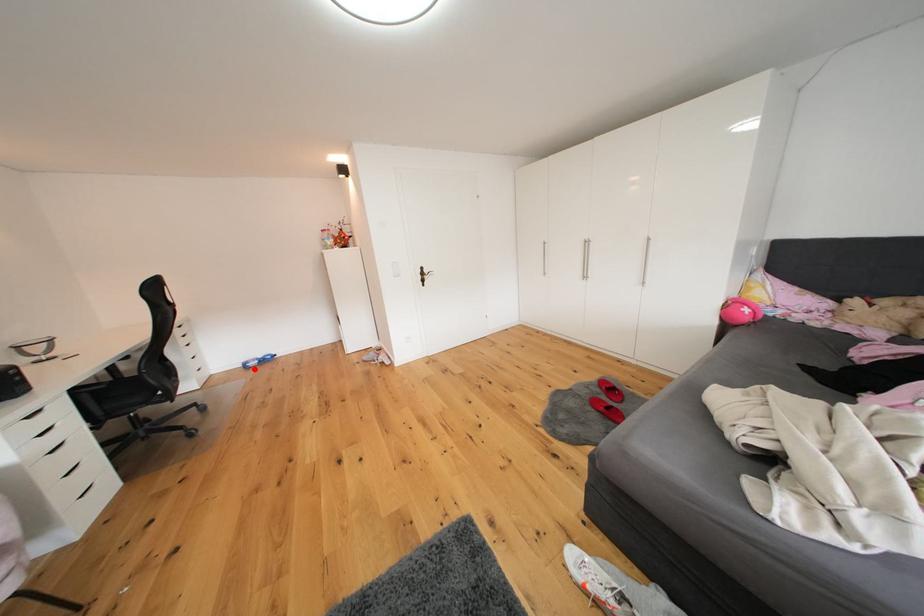
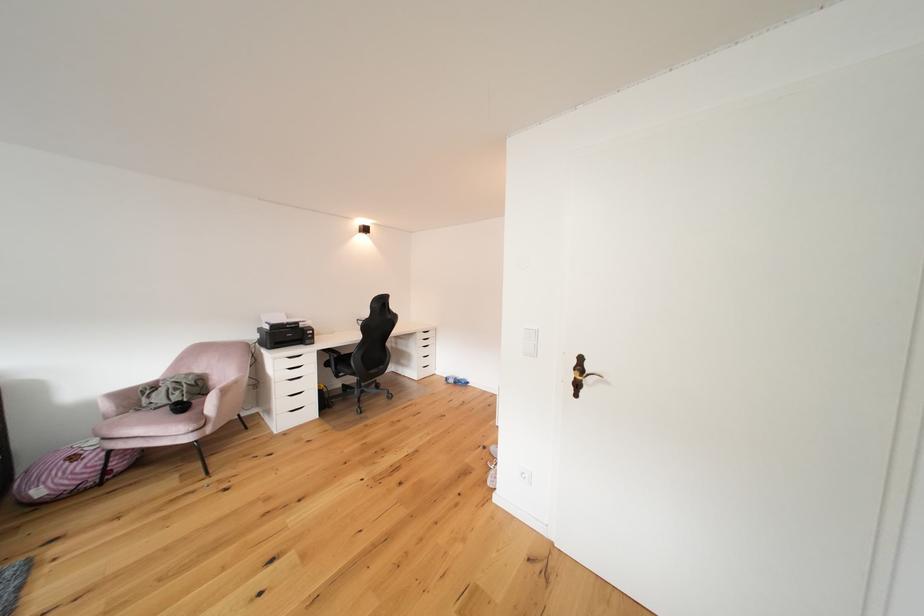
Question: I am providing you with two images of the same scene from different viewpoints. Given a red point in image1, look at the same physical point in image2. Is it:

Choices:
 (A) Closer to the viewpoint
 (B) Farther from the viewpoint

Answer: (B)